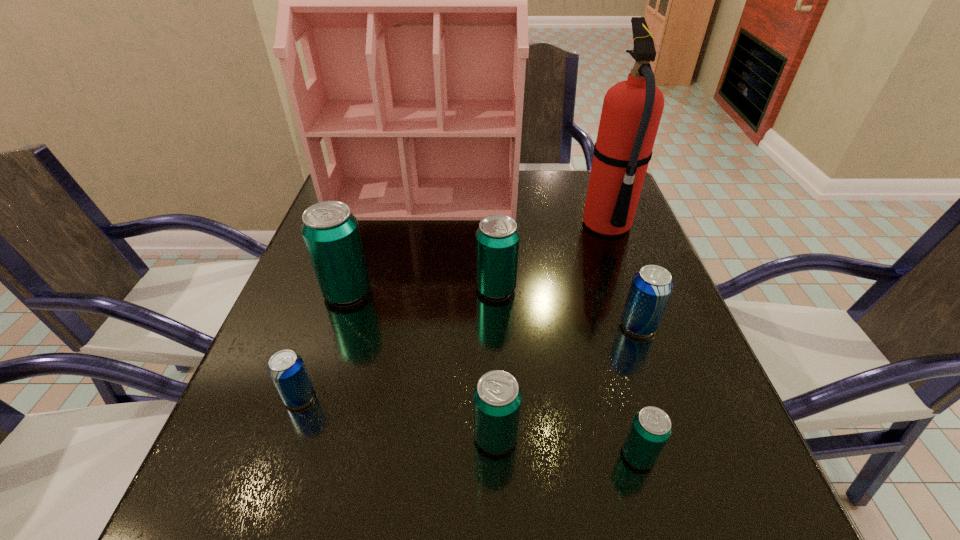
Identify the location of the left blue beer can. (286, 368).

The width and height of the screenshot is (960, 540). I want to click on the second beer can from right to left, so click(x=650, y=429).

Identify the location of the rightmost teal beer can. The image size is (960, 540). (650, 429).

At what (x,y) coordinates should I click in order to perform the action: click on free space located 0.290m on the front-facing side of the dollhouse. Please return your answer as a coordinate pair (x, y). The height and width of the screenshot is (540, 960). Looking at the image, I should click on (405, 304).

Locate an element on the screen. Image resolution: width=960 pixels, height=540 pixels. free space located 0.270m at the nozzle of the red fire extinguisher is located at coordinates (474, 225).

I want to click on free space located 0.380m at the nozzle of the red fire extinguisher, so click(431, 225).

Image resolution: width=960 pixels, height=540 pixels. I want to click on free space located 0.290m at the nozzle of the red fire extinguisher, so click(x=467, y=225).

Where is `free space located on the back of the leftmost teal beer can`? free space located on the back of the leftmost teal beer can is located at coordinates point(365,237).

Locate an element on the screen. The height and width of the screenshot is (540, 960). free spot located 0.380m on the left of the third smallest teal beer can is located at coordinates (298, 288).

Locate an element on the screen. vacant region located on the right of the fourth nearest object is located at coordinates (682, 325).